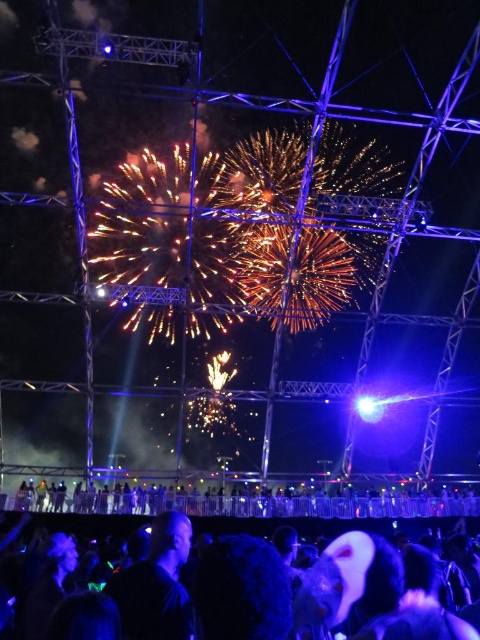
You are an event planner assessing the layout of the nighttime celebration. You notice two groups labeled as the black matte crowd at lower center and the black fabric crowd at lower center. Which group is positioned closer to the fireworks display?

The black matte crowd at lower center is closer to the fireworks display since the black fabric crowd at lower center is positioned behind them.

You are organizing a fireworks show and need to ensure safety by keeping the crowd at a safe distance. Given that the black matte crowd at lower center and the black fabric crowd at lower center are both present, which crowd occupies more horizontal space and thus requires more area for safety measures?

The black matte crowd at lower center has a greater width than the black fabric crowd at lower center, so it requires more area for safety measures.